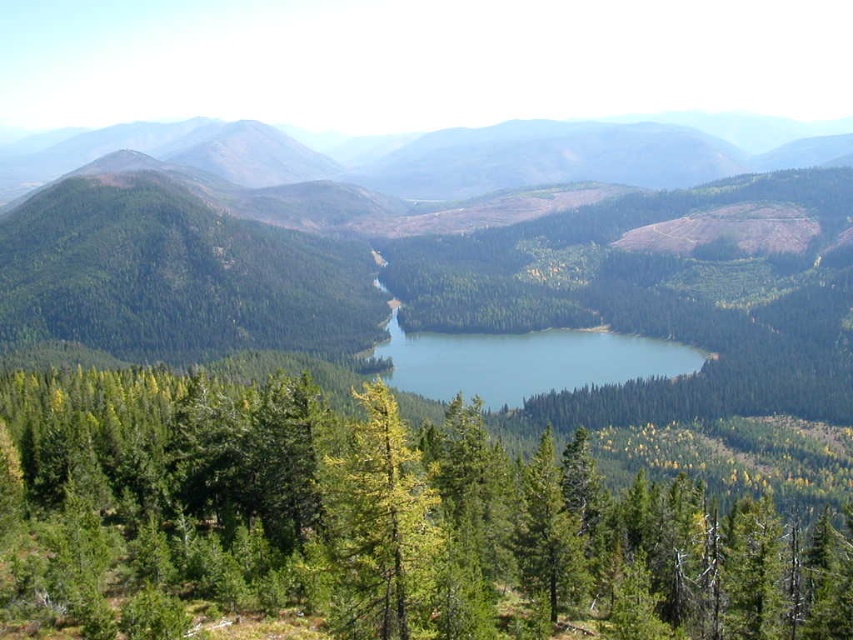
Based on the photo, you are a hiker standing at the edge of the forest looking towards the lake. You notice the green matte tree at center and the blue glossy water at center. Which of these two objects takes up more area in the scene?

The blue glossy water at center occupies more area than the green matte tree at center, as it is stated that the green matte tree at center occupies less space than the blue glossy water at center.

You are an environmental scientist assessing the ecological balance of the area. You observe the green matte tree at center and the blue glossy water at center. Which object occupies a larger area in the scene?

The green matte tree at center occupies a larger area than the blue glossy water at center, as its width surpasses that of the water.